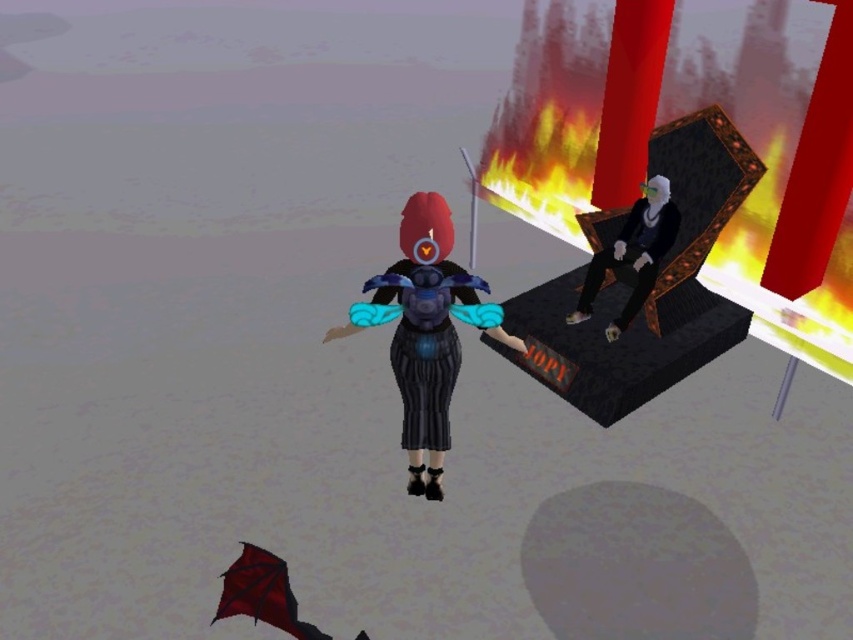
Between shiny blue dress at center and smooth black chair at right, which one appears on the right side from the viewer's perspective?

smooth black chair at right

Does point (421, 284) come in front of point (659, 244)?

That is True.

In order to click on shiny blue dress at center in this screenshot , I will do `click(426, 330)`.